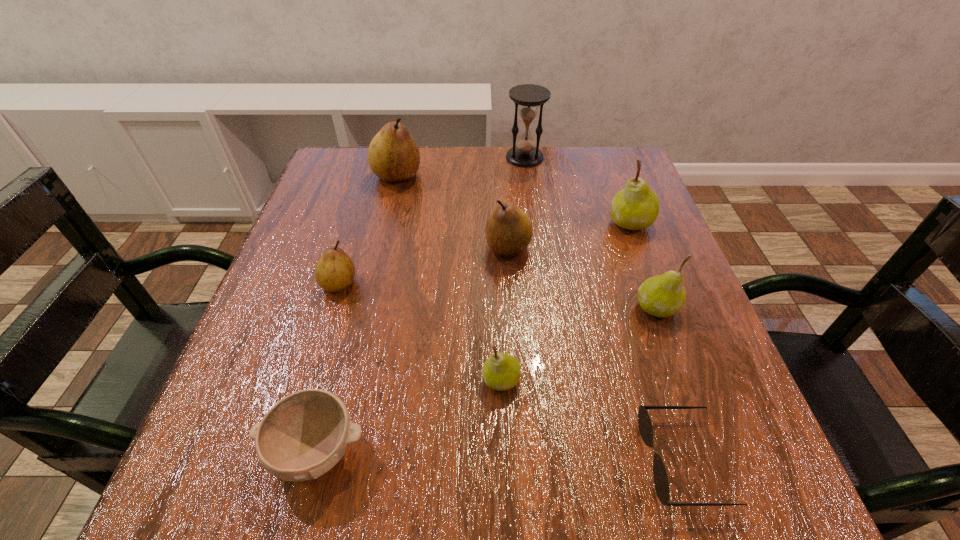
The height and width of the screenshot is (540, 960). Find the location of `black hourglass`. black hourglass is located at coordinates (525, 153).

This screenshot has height=540, width=960. I want to click on the farthest brown pear, so click(393, 155).

At what (x,y) coordinates should I click in order to perform the action: click on the farthest pear. Please return your answer as a coordinate pair (x, y). The image size is (960, 540). Looking at the image, I should click on (393, 155).

Where is `the farthest green pear`? Image resolution: width=960 pixels, height=540 pixels. the farthest green pear is located at coordinates (636, 207).

Locate an element on the screen. The image size is (960, 540). the rightmost brown pear is located at coordinates (509, 230).

The width and height of the screenshot is (960, 540). Identify the location of the second biggest brown pear. click(509, 230).

I want to click on the second biggest green pear, so click(x=664, y=295).

I want to click on the nearest brown pear, so click(x=335, y=270).

Find the location of `the nearest green pear`. the nearest green pear is located at coordinates (501, 371).

Where is `the nearest pear`? This screenshot has width=960, height=540. the nearest pear is located at coordinates (501, 371).